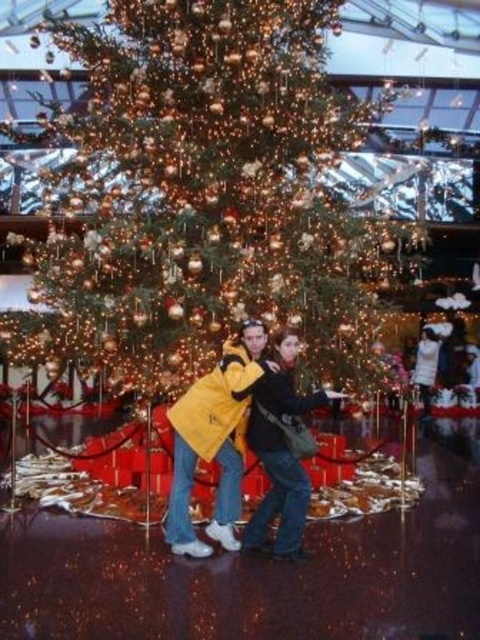
In the scene shown: You are a photographer trying to capture a clear photo of the shiny gold ornaments at center without the yellow matte jacket at center blocking the view. Based on the scene description, where should you position yourself relative to the Christmas tree?

The yellow matte jacket at center is behind the shiny gold ornaments at center, so to avoid the jacket blocking the view, you should position yourself in front of the shiny gold ornaments at center, closer to the Christmas tree.

Based on the photo, you are a photographer standing 5 meters away from the shiny gold ornaments at center and yellow matte jacket at center. You want to take a photo that includes both objects in the frame. Given that your camera has a maximum zoom range of 10 meters, can you capture both objects in a single shot without moving closer?

The shiny gold ornaments at center and yellow matte jacket at center are 12.63 meters apart. Since your camera can only zoom up to 10 meters, you cannot capture both objects in a single shot without moving closer.

You are organizing a Christmas photo shoot and need to ensure that the shiny gold ornaments at center and the yellow matte jacket at center are visible in the frame. Given that the camera has a fixed focal length, which object should you prioritize positioning closer to the camera to maintain clarity and detail?

The shiny gold ornaments at center should be positioned closer to the camera because their width surpasses that of the yellow matte jacket at center, ensuring their details remain clear even with the fixed focal length.